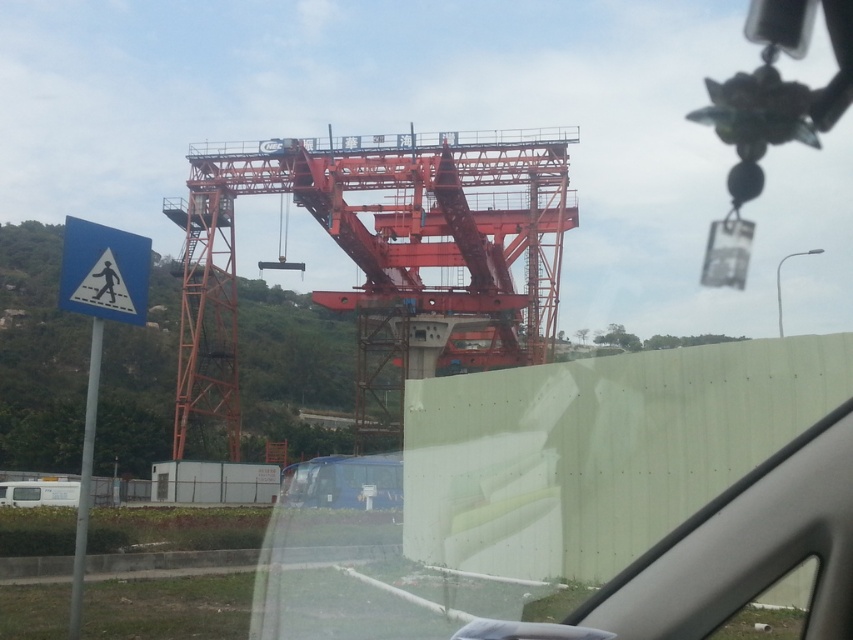
You are driving a car and looking through the windshield. You see an orange metallic crane at center and a blue matte truck at center. Which object is closer to you?

The blue matte truck at center is closer to you because the orange metallic crane at center is located above it, meaning the truck is in front in your line of sight.

You are sitting in the driver seat of the vehicle and want to look at the construction site outside. Where is the transparent glass windshield at upper center located in terms of coordinates?

The transparent glass windshield at upper center is located at coordinates point (595, 502).